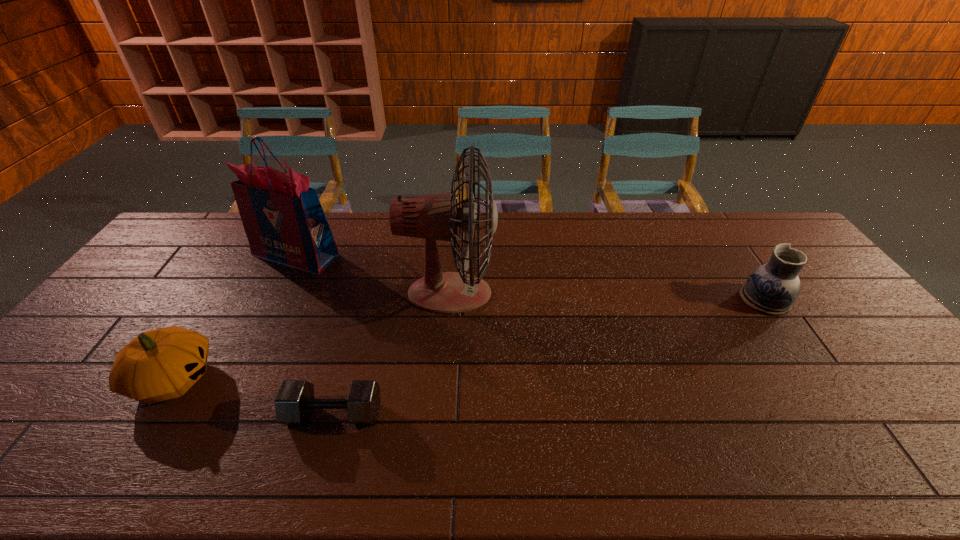
The height and width of the screenshot is (540, 960). What are the coordinates of `unoccupied area between the rightmost object and the third object from left to right` in the screenshot? It's located at (549, 357).

Identify the location of free space between the rightmost object and the grocery bag. Image resolution: width=960 pixels, height=540 pixels. (530, 278).

The image size is (960, 540). Identify the location of vacant area between the grocery bag and the dumbbell. (315, 335).

Locate an element on the screen. The image size is (960, 540). vacant point located between the gourd and the pottery is located at coordinates (469, 340).

Where is `free area in between the rightmost object and the grocery bag`? This screenshot has width=960, height=540. free area in between the rightmost object and the grocery bag is located at coordinates (530, 278).

Locate an element on the screen. This screenshot has width=960, height=540. vacant area that lies between the rightmost object and the gourd is located at coordinates (469, 340).

Where is `empty location between the dumbbell and the rightmost object`? The width and height of the screenshot is (960, 540). empty location between the dumbbell and the rightmost object is located at coordinates (549, 357).

This screenshot has width=960, height=540. Identify the location of object that can be found as the third closest to the grocery bag. (295, 401).

Where is `object that is the fourth nearest to the rightmost object`? This screenshot has height=540, width=960. object that is the fourth nearest to the rightmost object is located at coordinates (161, 364).

This screenshot has height=540, width=960. In order to click on free region that satisfies the following two spatial constraints: 1. on the front-facing side of the rightmost object; 2. on the right side of the grocery bag in this screenshot , I will do `click(273, 300)`.